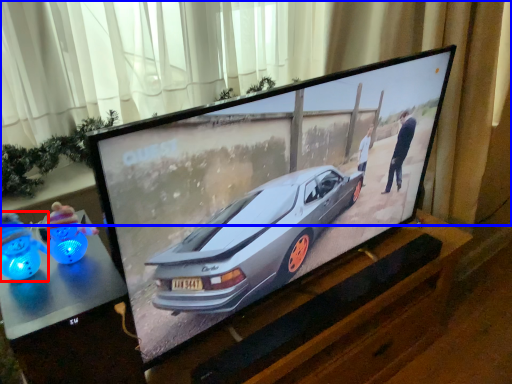
Question: Which of the following is the farthest to the observer, toy (highlighted by a red box) or curtain (highlighted by a blue box)?

Choices:
 (A) toy
 (B) curtain

Answer: (B)